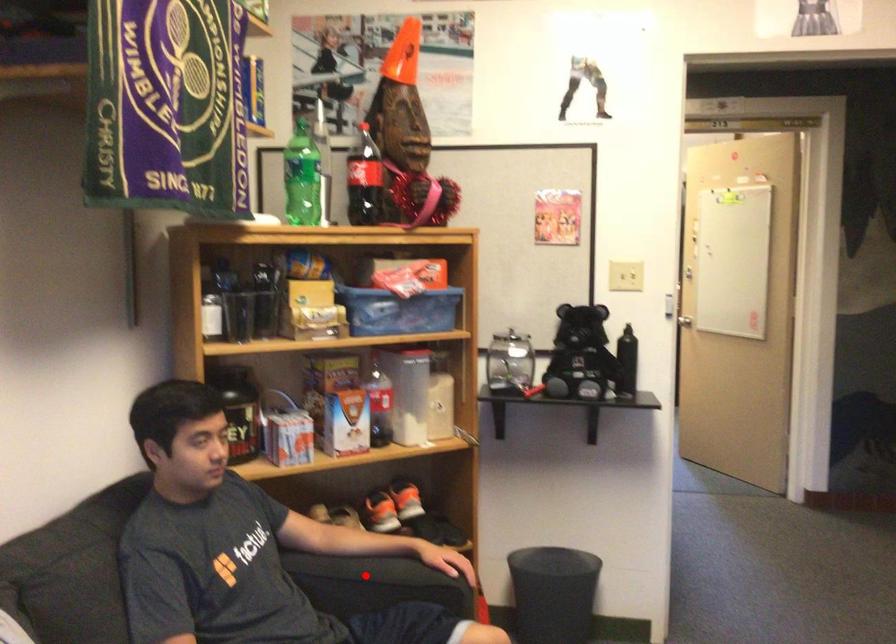
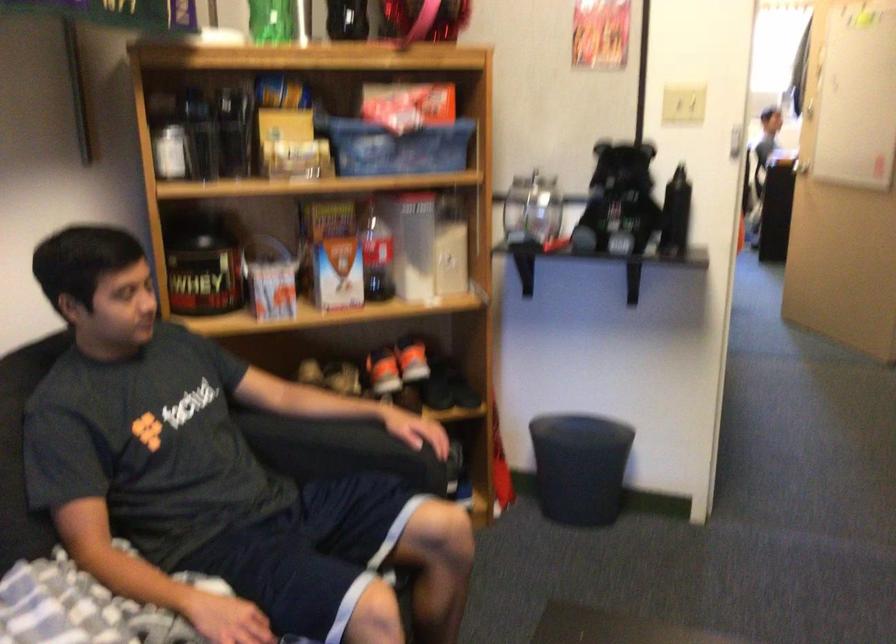
Find the pixel in the second image that matches the highlighted location in the first image.

(330, 444)